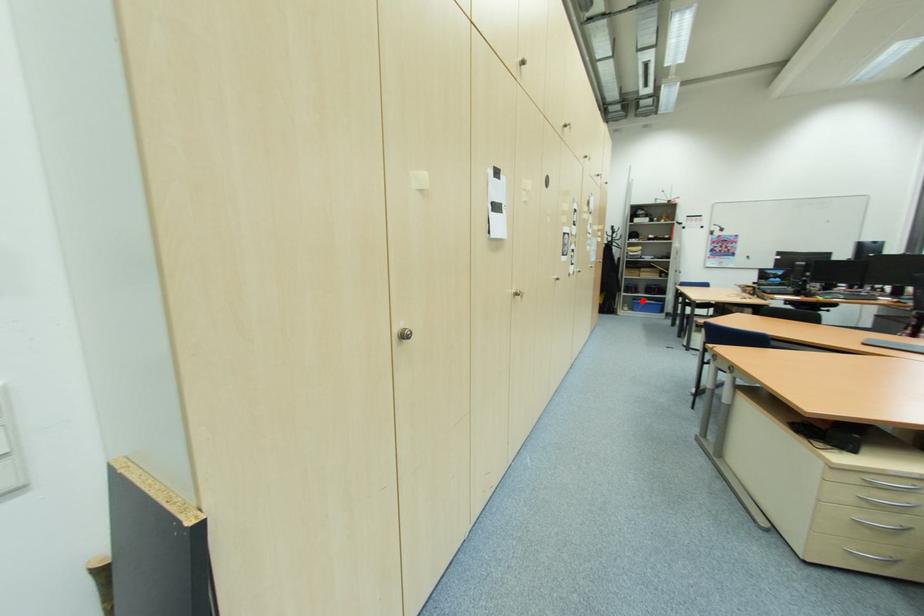
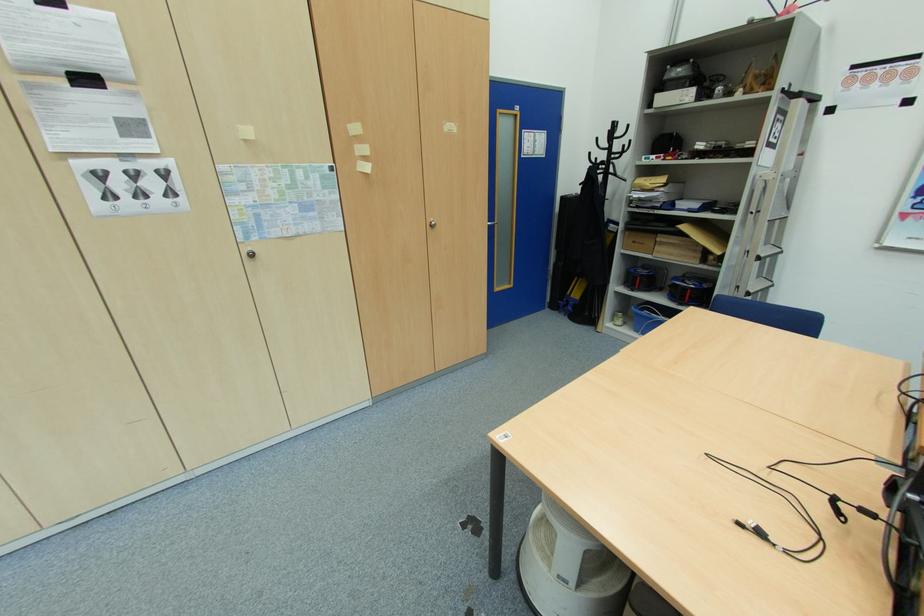
In the second image, find the point that corresponds to the highlighted location in the first image.

(646, 310)